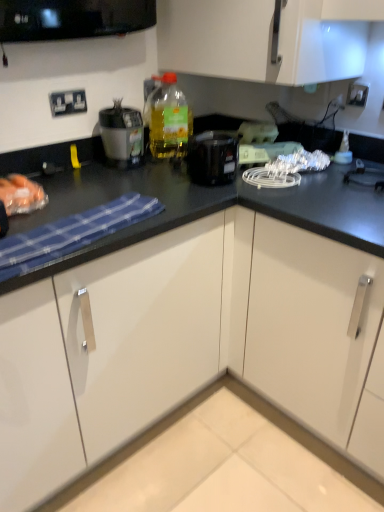
Question: Considering the relative positions of white plastic electric outlet at upper right, which is counted as the second electric outlet, starting from the left, and black plastic coffee maker at center in the image provided, is white plastic electric outlet at upper right, which is counted as the second electric outlet, starting from the left, to the left or to the right of black plastic coffee maker at center?

Choices:
 (A) right
 (B) left

Answer: (A)

Question: In the image, is white plastic electric outlet at upper right, which is counted as the second electric outlet, starting from the left, positioned in front of or behind black plastic coffee maker at center?

Choices:
 (A) behind
 (B) front

Answer: (A)

Question: Which object is the closest to the white plastic electric outlet at upper right, which is counted as the second electric outlet, starting from the left?

Choices:
 (A) white plastic electrical outlet at upper left, arranged as the second electric outlet when viewed from the right
 (B) black plastic coffee maker at center
 (C) white glossy cabinet at lower center
 (D) matte black blender at upper left
 (E) translucent plastic bottle at upper center

Answer: (B)

Question: Which object is positioned closest to the translucent plastic bottle at upper center?

Choices:
 (A) black plastic coffee maker at center
 (B) matte black blender at upper left
 (C) white plastic electrical outlet at upper left, which is the 1th electric outlet from left to right
 (D) white glossy cabinet at lower center
 (E) white plastic electric outlet at upper right, the 1th electric outlet viewed from the right

Answer: (B)